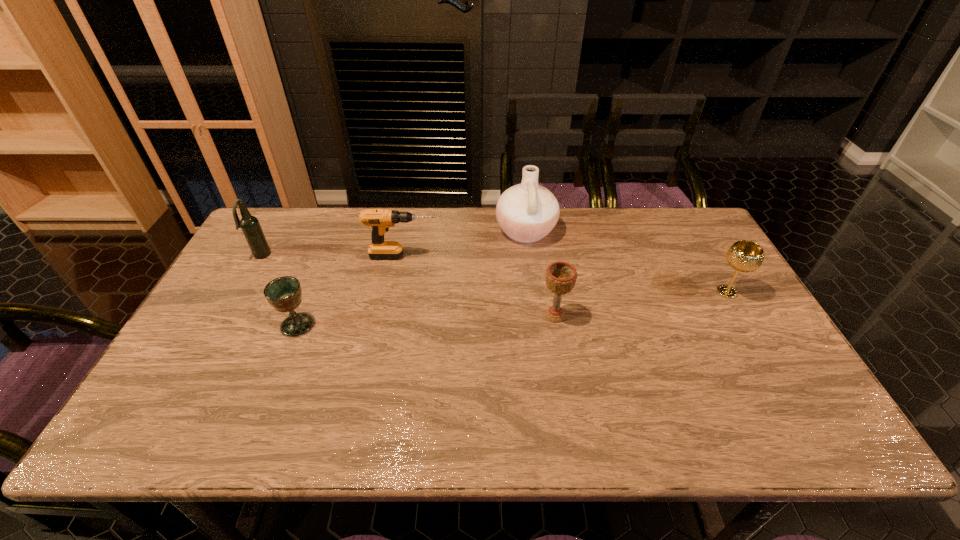
This screenshot has height=540, width=960. In order to click on free space that satisfies the following two spatial constraints: 1. to pour from the handle of the second chalice from left to right; 2. on the right side of the pottery in this screenshot , I will do `click(537, 316)`.